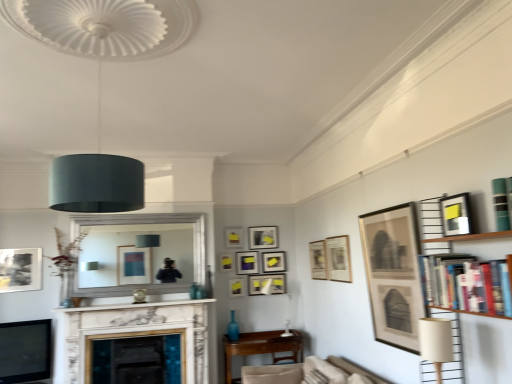
Measure the distance between point (233, 234) and camera.

They are 18.52 feet apart.

Where is `matte black picture frame at upper center, arranged as the ninth picture frame when viewed from the left`? matte black picture frame at upper center, arranged as the ninth picture frame when viewed from the left is located at coordinates (318, 260).

Measure the distance between matte yellow picture frame at upper center, the ninth picture frame positioned from the right, and camera.

matte yellow picture frame at upper center, the ninth picture frame positioned from the right, and camera are 5.49 meters apart from each other.

What do you see at coordinates (393, 274) in the screenshot? This screenshot has height=384, width=512. I see `matte black picture frame at upper right, the eleventh picture frame when ordered from left to right` at bounding box center [393, 274].

Where is `matte black picture frame at upper right, the eleventh picture frame when ordered from left to right`? Image resolution: width=512 pixels, height=384 pixels. matte black picture frame at upper right, the eleventh picture frame when ordered from left to right is located at coordinates (393, 274).

Find the location of a particular element. This screenshot has width=512, height=384. wooden table at center is located at coordinates (262, 347).

Where is `matte black picture frame at center, the eighth picture frame positioned from the right`? matte black picture frame at center, the eighth picture frame positioned from the right is located at coordinates (247, 263).

Image resolution: width=512 pixels, height=384 pixels. What do you see at coordinates (20, 269) in the screenshot?
I see `matte black picture frame at left, the fifth picture frame viewed from the front` at bounding box center [20, 269].

Identify the location of matte black picture frame at left, which is the first picture frame from left to right. (20, 269).

Identify the location of matte yellow picture frame at upper center, acting as the 10th picture frame starting from the front. The width and height of the screenshot is (512, 384). (233, 237).

Is hardcover books at right in contact with matte black picture frame at center, which is the 9th picture frame in front-to-back order?

They are not placed beside each other.

Is hardcover books at right behind matte black picture frame at center, the eighth picture frame positioned from the right?

No, hardcover books at right is closer to the viewer.

Between hardcover books at right and matte black picture frame at center, the eighth picture frame positioned from the right, which one has smaller size?

With smaller size is matte black picture frame at center, the eighth picture frame positioned from the right.

In the scene shown: What's the angular difference between hardcover books at right and matte black picture frame at center, the 5th picture frame positioned from the left,'s facing directions?

89.7 degrees.

Choose the correct answer: Is white marble fireplace at center inside matte beige lampshade at lower right, placed as the 2th lamp when sorted from top to bottom, or outside it?

white marble fireplace at center cannot be found inside matte beige lampshade at lower right, placed as the 2th lamp when sorted from top to bottom.

From a real-world perspective, is white marble fireplace at center physically above matte beige lampshade at lower right, acting as the first lamp starting from the right?

Actually, white marble fireplace at center is physically below matte beige lampshade at lower right, acting as the first lamp starting from the right, in the real world.

Could you measure the distance between white marble fireplace at center and matte beige lampshade at lower right, which is counted as the 1th lamp, starting from the bottom?

white marble fireplace at center is 11.63 feet away from matte beige lampshade at lower right, which is counted as the 1th lamp, starting from the bottom.

Which is in front, white marble fireplace at center or matte beige lampshade at lower right, which is counted as the 1th lamp, starting from the bottom?

matte beige lampshade at lower right, which is counted as the 1th lamp, starting from the bottom, is more forward.

What's the angular difference between matte black picture frame at upper right, acting as the first picture frame starting from the right, and hardcover books at right's facing directions?

The angular difference between matte black picture frame at upper right, acting as the first picture frame starting from the right, and hardcover books at right is 1.44 degrees.

Between matte black picture frame at upper right, marked as the 1th picture frame in a front-to-back arrangement, and hardcover books at right, which one is positioned behind?

matte black picture frame at upper right, marked as the 1th picture frame in a front-to-back arrangement, is behind.

Can you confirm if matte black picture frame at upper right, the 12th picture frame when ordered from back to front, is taller than hardcover books at right?

No, matte black picture frame at upper right, the 12th picture frame when ordered from back to front, is not taller than hardcover books at right.

Based on their positions, is matte black picture frame at upper right, marked as the 1th picture frame in a front-to-back arrangement, located to the left or right of hardcover books at right?

matte black picture frame at upper right, marked as the 1th picture frame in a front-to-back arrangement, is positioned on hardcover books at right's right side.

Which point is more distant from viewer, (342, 268) or (33, 278)?

The point (33, 278) is behind.

Find the location of a particular element. the 9th picture frame counting from the left of the matte black picture frame at upper right, the third picture frame in the front-to-back sequence is located at coordinates (20, 269).

From a real-world perspective, is matte black picture frame at upper right, the third picture frame in the front-to-back sequence, physically above matte black picture frame at left, the eighth picture frame in the back-to-front sequence?

No, from a real-world perspective, matte black picture frame at upper right, the third picture frame in the front-to-back sequence, is not above matte black picture frame at left, the eighth picture frame in the back-to-front sequence.

Looking at this image, is matte black picture frame at upper center, which is the twelfth picture frame from front to back, far from beige fabric swivel chair at lower center?

Yes, matte black picture frame at upper center, which is the twelfth picture frame from front to back, and beige fabric swivel chair at lower center are quite far apart.

Is matte black picture frame at upper center, the 7th picture frame viewed from the right, positioned in front of beige fabric swivel chair at lower center?

No, matte black picture frame at upper center, the 7th picture frame viewed from the right, is further to the viewer.

Choose the correct answer: Is matte black picture frame at upper center, the 7th picture frame viewed from the right, inside beige fabric swivel chair at lower center or outside it?

matte black picture frame at upper center, the 7th picture frame viewed from the right, is outside beige fabric swivel chair at lower center.

Is matte black picture frame at upper center, the first picture frame when ordered from back to front, facing away from beige fabric swivel chair at lower center?

matte black picture frame at upper center, the first picture frame when ordered from back to front, does not have its back to beige fabric swivel chair at lower center.

Considering the points (345, 360) and (333, 250), which point is in front, point (345, 360) or point (333, 250)?

The point (345, 360) is more forward.

In terms of width, does beige fabric swivel chair at lower center look wider or thinner when compared to matte black picture frame at upper right, the third picture frame in the front-to-back sequence?

Considering their sizes, beige fabric swivel chair at lower center looks broader than matte black picture frame at upper right, the third picture frame in the front-to-back sequence.

Is the depth of beige fabric swivel chair at lower center greater than that of matte black picture frame at upper right, marked as the tenth picture frame in a back-to-front arrangement?

No, it is not.

From a real-world perspective, is beige fabric swivel chair at lower center over matte black picture frame at upper right, marked as the tenth picture frame in a back-to-front arrangement?

No, from a real-world perspective, beige fabric swivel chair at lower center is not on top of matte black picture frame at upper right, marked as the tenth picture frame in a back-to-front arrangement.

Are matte beige lampshade at lower right, placed as the 2th lamp when sorted from top to bottom, and teal matte bookshelf at upper right making contact?

They are not placed beside each other.

Does matte beige lampshade at lower right, placed as the 2th lamp when sorted from top to bottom, have a greater height compared to teal matte bookshelf at upper right?

Correct, matte beige lampshade at lower right, placed as the 2th lamp when sorted from top to bottom, is much taller as teal matte bookshelf at upper right.

Between matte beige lampshade at lower right, acting as the first lamp starting from the right, and teal matte bookshelf at upper right, which one appears on the right side from the viewer's perspective?

Positioned to the right is teal matte bookshelf at upper right.

Between matte beige lampshade at lower right, acting as the first lamp starting from the right, and teal matte bookshelf at upper right, which one has smaller size?

Smaller between the two is teal matte bookshelf at upper right.

There is a hardcover books at right. In order to click on the 9th picture frame below it (from the image's perspective) in this screenshot , I will do `click(247, 263)`.

This screenshot has height=384, width=512. What are the coordinates of `the 1st lamp above the white marble fireplace at center (from the image's perspective)` in the screenshot? It's located at (436, 342).

From the picture: Considering their positions, is matte black picture frame at upper right, marked as the tenth picture frame in a back-to-front arrangement, positioned further to matte black picture frame at center, the 5th picture frame positioned from the left, than matte black picture frame at left, the fifth picture frame viewed from the front?

matte black picture frame at left, the fifth picture frame viewed from the front, is further to matte black picture frame at center, the 5th picture frame positioned from the left.

When comparing their distances from matte beige lampshade at lower right, placed as the 2th lamp when sorted from top to bottom, does teal matte bookshelf at upper right or beige fabric swivel chair at lower center seem closer?

teal matte bookshelf at upper right.

When comparing their distances from matte black picture frame at upper right, positioned as the 12th picture frame in left-to-right order, does matte black picture frame at upper center, which appears as the fourth picture frame when viewed from the right, or wooden table at center seem closer?

matte black picture frame at upper center, which appears as the fourth picture frame when viewed from the right, is closer to matte black picture frame at upper right, positioned as the 12th picture frame in left-to-right order.

From the image, which object appears to be nearer to matte yellow picture frame at upper center, acting as the 7th picture frame starting from the back, matte beige lampshade at lower right, placed as the 2th lamp when sorted from top to bottom, or matte yellow picture frame at center, which ranks as the second picture frame in left-to-right order?

The object closer to matte yellow picture frame at upper center, acting as the 7th picture frame starting from the back, is matte yellow picture frame at center, which ranks as the second picture frame in left-to-right order.

From the image, which object appears to be nearer to matte beige lampshade at lower right, acting as the first lamp starting from the right, matte yellow picture frame at center, which appears as the 11th picture frame when viewed from the right, or matte black picture frame at upper right, acting as the first picture frame starting from the right?

Based on the image, matte black picture frame at upper right, acting as the first picture frame starting from the right, appears to be nearer to matte beige lampshade at lower right, acting as the first lamp starting from the right.

Looking at the image, which one is located closer to beige fabric swivel chair at lower center, matte black picture frame at upper right, which appears as the 10th picture frame when viewed from the left, or hardcover books at right?

Among the two, matte black picture frame at upper right, which appears as the 10th picture frame when viewed from the left, is located nearer to beige fabric swivel chair at lower center.

Based on their spatial positions, is matte black picture frame at upper center, the 7th picture frame viewed from the right, or silver metallic mirror at center closer to hardcover books at right?

matte black picture frame at upper center, the 7th picture frame viewed from the right, is closer to hardcover books at right.

From the picture: Looking at the image, which one is located closer to wooden table at center, matte yellow picture frame at upper center, the 4th picture frame in the left-to-right sequence, or matte black picture frame at upper right, placed as the 2th picture frame when sorted from front to back?

matte yellow picture frame at upper center, the 4th picture frame in the left-to-right sequence, is positioned closer to the anchor wooden table at center.

This screenshot has width=512, height=384. In order to click on mirror located between teal matte bookshelf at upper right and matte black picture frame at center, the eighth picture frame positioned from the right, in the depth direction in this screenshot , I will do `click(134, 254)`.

Locate an element on the screen. Image resolution: width=512 pixels, height=384 pixels. table positioned between teal matte bookshelf at upper right and matte yellow picture frame at upper center, the ninth picture frame positioned from the right, from near to far is located at coordinates (262, 347).

Find the location of `fireplace located between teal matte bookshelf at upper right and matte white picture frame at upper center, the sixth picture frame from the right, in the depth direction`. fireplace located between teal matte bookshelf at upper right and matte white picture frame at upper center, the sixth picture frame from the right, in the depth direction is located at coordinates (143, 334).

In order to click on fireplace positioned between matte black lampshade at upper center, which ranks as the 2th lamp in right-to-left order, and matte black picture frame at upper center, the 2th picture frame from the back, from near to far in this screenshot , I will do `click(143, 334)`.